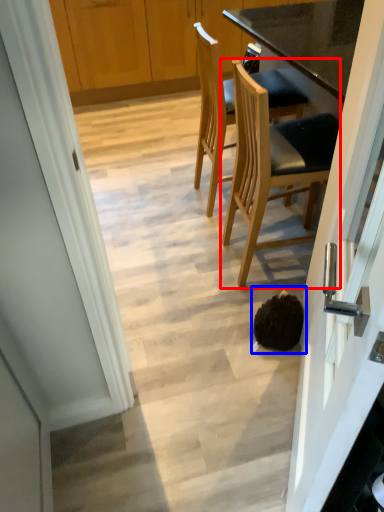
Question: Which point is further to the camera, chair (highlighted by a red box) or head (highlighted by a blue box)?

Choices:
 (A) chair
 (B) head

Answer: (B)